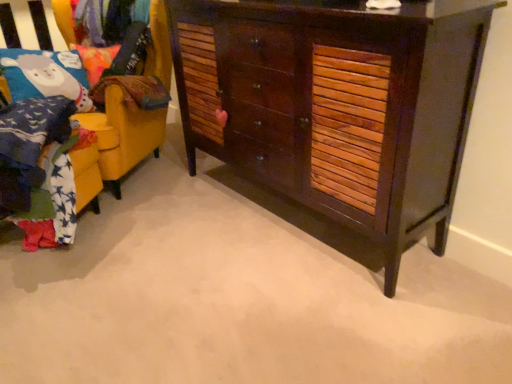
Question: Would you say dark wood cabinet at center is part of yellow fabric chair at left's contents?

Choices:
 (A) no
 (B) yes

Answer: (A)

Question: Is yellow fabric chair at left to the right of dark wood cabinet at center from the viewer's perspective?

Choices:
 (A) yes
 (B) no

Answer: (B)

Question: Is yellow fabric chair at left smaller than dark wood cabinet at center?

Choices:
 (A) no
 (B) yes

Answer: (A)

Question: Is yellow fabric chair at left oriented away from dark wood cabinet at center?

Choices:
 (A) yes
 (B) no

Answer: (B)

Question: Considering the relative sizes of yellow fabric chair at left and dark wood cabinet at center in the image provided, is yellow fabric chair at left thinner than dark wood cabinet at center?

Choices:
 (A) no
 (B) yes

Answer: (A)

Question: Is yellow fabric chair at left positioned before dark wood cabinet at center?

Choices:
 (A) yes
 (B) no

Answer: (B)

Question: Is dark wood cabinet at center inside velvet fabric pillow at upper left?

Choices:
 (A) no
 (B) yes

Answer: (A)

Question: Is velvet fabric pillow at upper left turned away from dark wood cabinet at center?

Choices:
 (A) yes
 (B) no

Answer: (B)

Question: Can you confirm if velvet fabric pillow at upper left is thinner than dark wood cabinet at center?

Choices:
 (A) yes
 (B) no

Answer: (A)

Question: Considering the relative sizes of velvet fabric pillow at upper left and dark wood cabinet at center in the image provided, is velvet fabric pillow at upper left smaller than dark wood cabinet at center?

Choices:
 (A) yes
 (B) no

Answer: (A)

Question: From a real-world perspective, is velvet fabric pillow at upper left physically below dark wood cabinet at center?

Choices:
 (A) yes
 (B) no

Answer: (B)

Question: Is velvet fabric pillow at upper left oriented towards dark wood cabinet at center?

Choices:
 (A) no
 (B) yes

Answer: (A)

Question: Can you confirm if dark wood cabinet at center is smaller than velvet fabric pillow at upper left?

Choices:
 (A) no
 (B) yes

Answer: (A)